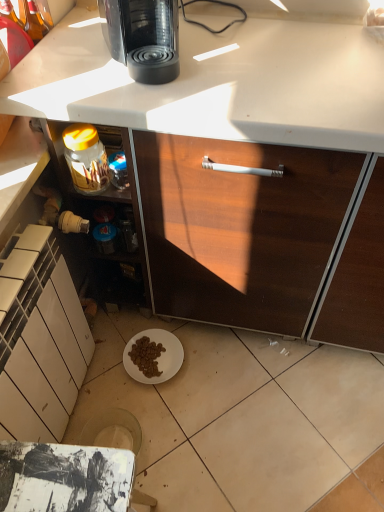
Question: In terms of size, does black glossy coffee maker at upper center appear bigger or smaller than white matte cabinet at lower left?

Choices:
 (A) small
 (B) big

Answer: (A)

Question: From the image's perspective, is black glossy coffee maker at upper center located above or below white matte cabinet at lower left?

Choices:
 (A) above
 (B) below

Answer: (A)

Question: Which is farther from the black glossy coffee maker at upper center?

Choices:
 (A) white matte cabinet at lower left
 (B) translucent glass jar at lower left

Answer: (A)

Question: Which of these objects is positioned closest to the translucent glass jar at lower left?

Choices:
 (A) white matte cabinet at lower left
 (B) black glossy coffee maker at upper center

Answer: (B)